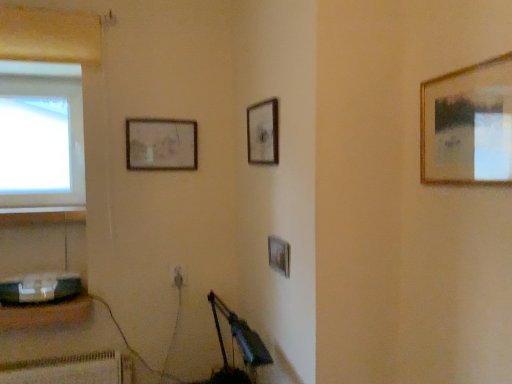
Question: Is transparent glass window at upper left turned away from matte wooden picture frame at upper center, the first picture frame in the back-to-front sequence?

Choices:
 (A) no
 (B) yes

Answer: (A)

Question: Is transparent glass window at upper left completely or partially outside of matte wooden picture frame at upper center, marked as the first picture frame in a left-to-right arrangement?

Choices:
 (A) no
 (B) yes

Answer: (B)

Question: Does transparent glass window at upper left have a larger size compared to matte wooden picture frame at upper center, marked as the first picture frame in a left-to-right arrangement?

Choices:
 (A) yes
 (B) no

Answer: (A)

Question: From a real-world perspective, is transparent glass window at upper left under matte wooden picture frame at upper center, marked as the first picture frame in a left-to-right arrangement?

Choices:
 (A) yes
 (B) no

Answer: (B)

Question: From the image's perspective, does transparent glass window at upper left appear higher than matte wooden picture frame at upper center, which ranks as the fourth picture frame in right-to-left order?

Choices:
 (A) yes
 (B) no

Answer: (A)

Question: From a real-world perspective, is transparent glass window at upper left over matte wooden picture frame at upper center, which ranks as the fourth picture frame in right-to-left order?

Choices:
 (A) no
 (B) yes

Answer: (B)

Question: Does transparent glass window at upper left turn towards wooden picture frame at upper center, the 2th picture frame positioned from the back?

Choices:
 (A) yes
 (B) no

Answer: (B)

Question: From a real-world perspective, is transparent glass window at upper left positioned under wooden picture frame at upper center, the third picture frame viewed from the right, based on gravity?

Choices:
 (A) yes
 (B) no

Answer: (B)

Question: Does transparent glass window at upper left appear on the right side of wooden picture frame at upper center, the 2th picture frame positioned from the back?

Choices:
 (A) no
 (B) yes

Answer: (A)

Question: Can you confirm if transparent glass window at upper left is wider than wooden picture frame at upper center, the 2th picture frame positioned from the back?

Choices:
 (A) no
 (B) yes

Answer: (B)

Question: From a real-world perspective, is transparent glass window at upper left over wooden picture frame at upper center, the 2th picture frame positioned from the back?

Choices:
 (A) no
 (B) yes

Answer: (B)

Question: Considering the relative positions of transparent glass window at upper left and wooden picture frame at upper center, positioned as the third picture frame in front-to-back order, in the image provided, is transparent glass window at upper left in front of wooden picture frame at upper center, positioned as the third picture frame in front-to-back order,?

Choices:
 (A) yes
 (B) no

Answer: (B)

Question: Is metallic gray speaker at lower left to the right of matte wooden picture frame at upper center, marked as the first picture frame in a left-to-right arrangement, from the viewer's perspective?

Choices:
 (A) yes
 (B) no

Answer: (B)